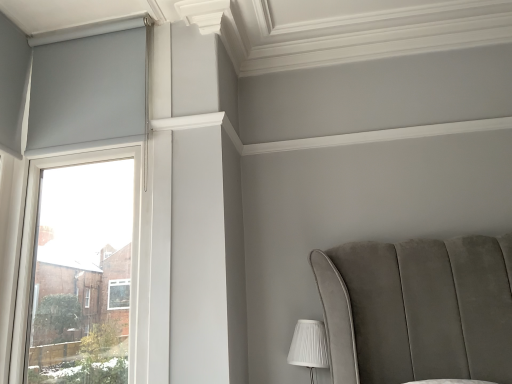
Question: From a real-world perspective, relative to matte gray roller blind at left, is white pleated fabric at lower right vertically above or below?

Choices:
 (A) above
 (B) below

Answer: (B)

Question: Relative to matte gray roller blind at left, is white pleated fabric at lower right in front or behind?

Choices:
 (A) behind
 (B) front

Answer: (A)

Question: Considering the positions of point (310, 360) and point (54, 162), is point (310, 360) closer or farther from the camera than point (54, 162)?

Choices:
 (A) farther
 (B) closer

Answer: (B)

Question: From the image's perspective, relative to white pleated fabric at lower right, is matte gray roller blind at left above or below?

Choices:
 (A) below
 (B) above

Answer: (B)

Question: Looking at their shapes, would you say matte gray roller blind at left is wider or thinner than white pleated fabric at lower right?

Choices:
 (A) wide
 (B) thin

Answer: (B)

Question: Is matte gray roller blind at left taller or shorter than white pleated fabric at lower right?

Choices:
 (A) tall
 (B) short

Answer: (A)

Question: Considering the positions of point (32, 180) and point (307, 331), is point (32, 180) closer or farther from the camera than point (307, 331)?

Choices:
 (A) closer
 (B) farther

Answer: (B)